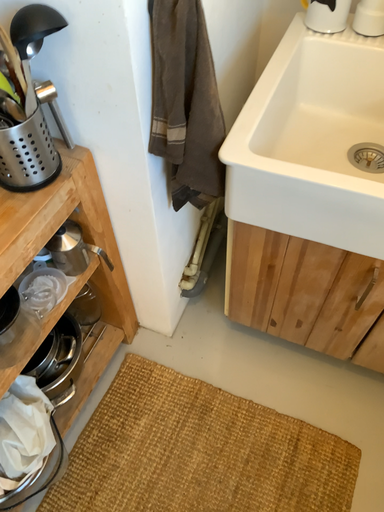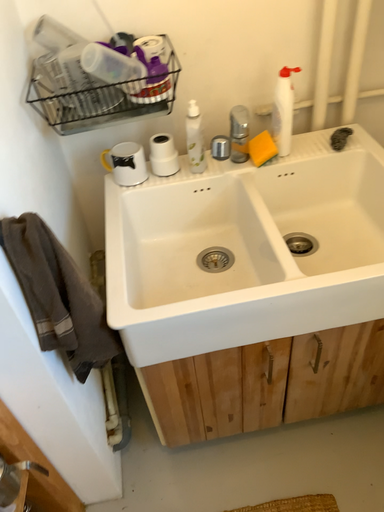
Question: Which way did the camera rotate in the video?

Choices:
 (A) rotated upward
 (B) rotated downward

Answer: (A)